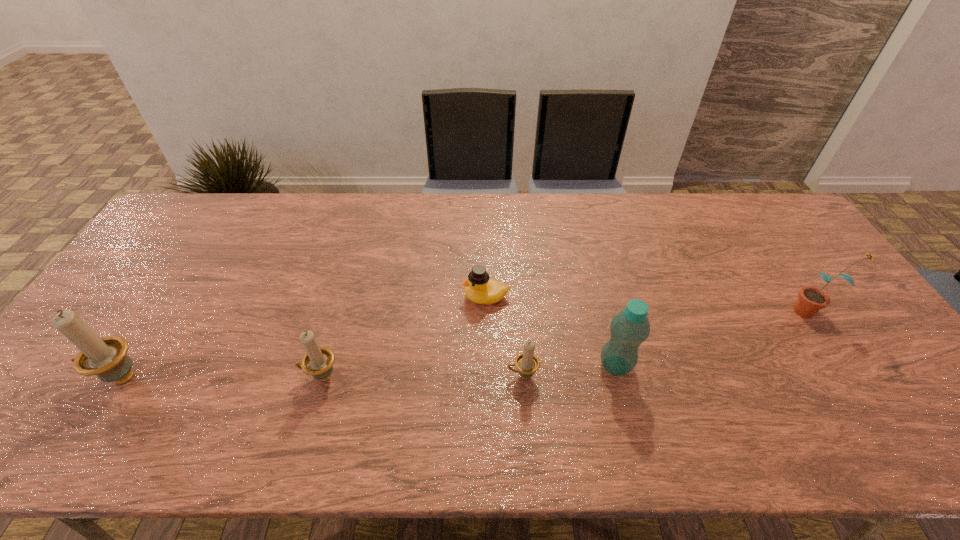
Where is `vacant space located 0.340m on the handle side of the second candle_holder from left to right`? This screenshot has height=540, width=960. vacant space located 0.340m on the handle side of the second candle_holder from left to right is located at coordinates (162, 376).

Locate an element on the screen. The width and height of the screenshot is (960, 540). vacant space located 0.380m on the handle side of the second candle_holder from left to right is located at coordinates (146, 376).

The height and width of the screenshot is (540, 960). I want to click on blank space located on the handle side of the second candle_holder from left to right, so click(x=281, y=376).

At what (x,y) coordinates should I click in order to perform the action: click on vacant space located on the handle side of the shortest candle_holder. Please return your answer as a coordinate pair (x, y). Image resolution: width=960 pixels, height=540 pixels. Looking at the image, I should click on point(364,375).

The height and width of the screenshot is (540, 960). What are the coordinates of `vacant space located 0.170m on the handle side of the shortest candle_holder` in the screenshot? It's located at (438, 375).

At what (x,y) coordinates should I click in order to perform the action: click on free spot located on the handle side of the shortest candle_holder. Please return your answer as a coordinate pair (x, y). This screenshot has height=540, width=960. Looking at the image, I should click on point(462,375).

I want to click on vacant space located on the flower of the rightmost object, so click(x=679, y=310).

Where is `vacant area situated on the flower of the rightmost object`? The width and height of the screenshot is (960, 540). vacant area situated on the flower of the rightmost object is located at coordinates (704, 310).

Locate an element on the screen. The width and height of the screenshot is (960, 540). vacant space located 0.190m on the flower of the rightmost object is located at coordinates (722, 310).

I want to click on vacant space located 0.100m at the front cap of the water bottle, so click(x=559, y=366).